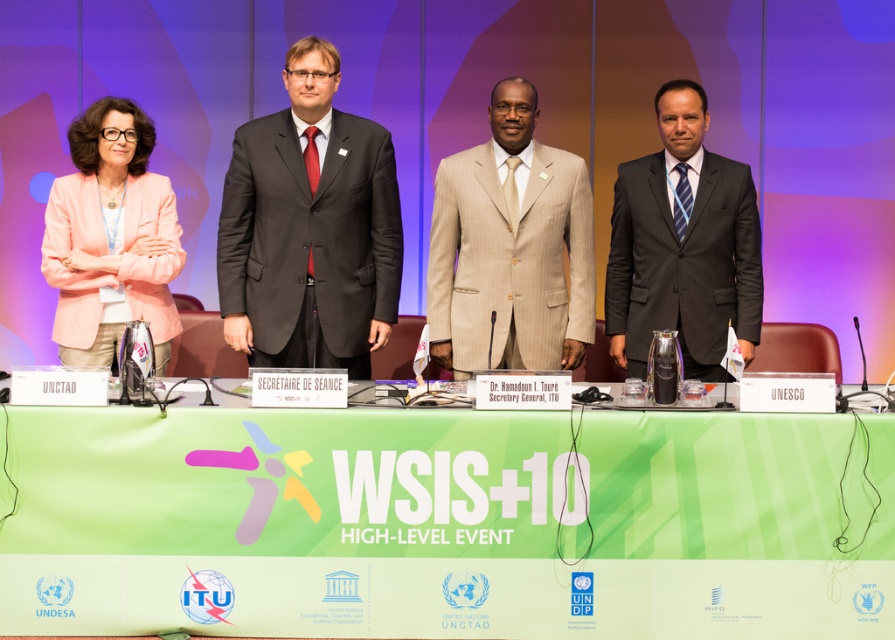
Question: Is green fabric table at center thinner than matte pink blazer at left?

Choices:
 (A) yes
 (B) no

Answer: (B)

Question: Which object appears farthest from the camera in this image?

Choices:
 (A) matte black suit at center
 (B) green fabric table at center

Answer: (A)

Question: Which point appears farthest from the camera in this image?

Choices:
 (A) (795, 618)
 (B) (748, 166)

Answer: (B)

Question: Is green fabric table at center smaller than matte black suit at right?

Choices:
 (A) yes
 (B) no

Answer: (A)

Question: Is matte black suit at center smaller than beige pinstripe suit at center?

Choices:
 (A) no
 (B) yes

Answer: (A)

Question: Which point appears closest to the camera in this image?

Choices:
 (A) (608, 310)
 (B) (305, 115)
 (C) (149, 250)

Answer: (B)